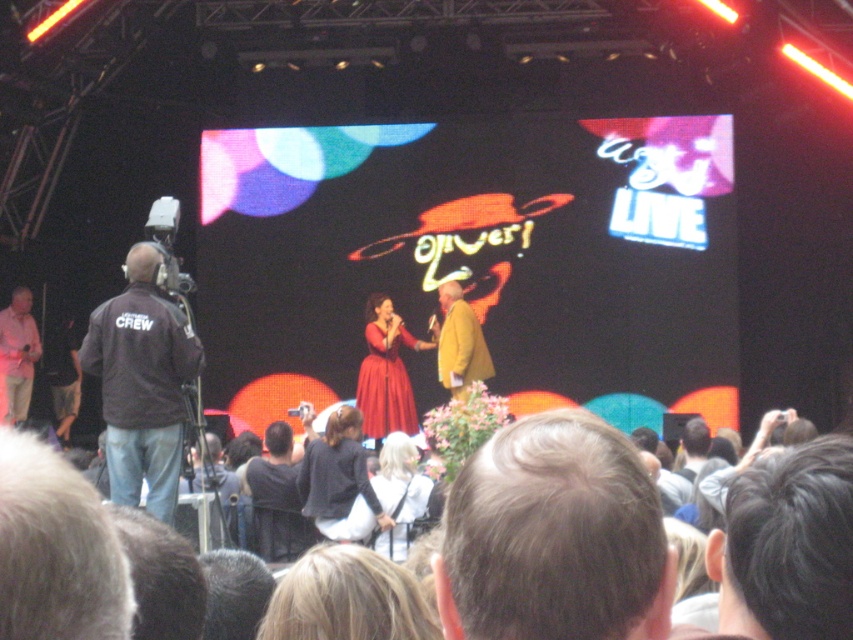
Measure the distance between matte red dress at center and camera.

They are 281.13 feet apart.

Does matte red dress at center have a greater height compared to white matte dress at center?

Yes, matte red dress at center is taller than white matte dress at center.

What are the coordinates of `matte red dress at center` in the screenshot? It's located at (386, 372).

The width and height of the screenshot is (853, 640). In order to click on matte red dress at center in this screenshot , I will do pos(386,372).

Does point (375, 496) come closer to viewer compared to point (413, 502)?

No.

Is matte black dress at center to the left of white matte dress at center from the viewer's perspective?

Yes, matte black dress at center is to the left of white matte dress at center.

Does point (329, 516) come closer to viewer compared to point (421, 513)?

No, it is not.

Where is `matte black dress at center`? matte black dress at center is located at coordinates (337, 472).

Who is lower down, dark brown hair at center or matte black dress at center?

Positioned lower is matte black dress at center.

Which is behind, point (647, 592) or point (349, 420)?

Positioned behind is point (349, 420).

You are a GUI agent. You are given a task and a screenshot of the screen. Output one action in this format:
    pyautogui.click(x=<x>, y=<y>)
    Task: Click on the dark brown hair at center
    
    Given the screenshot: What is the action you would take?
    pyautogui.click(x=554, y=536)

Locate an element on the screen. dark brown hair at center is located at coordinates (554, 536).